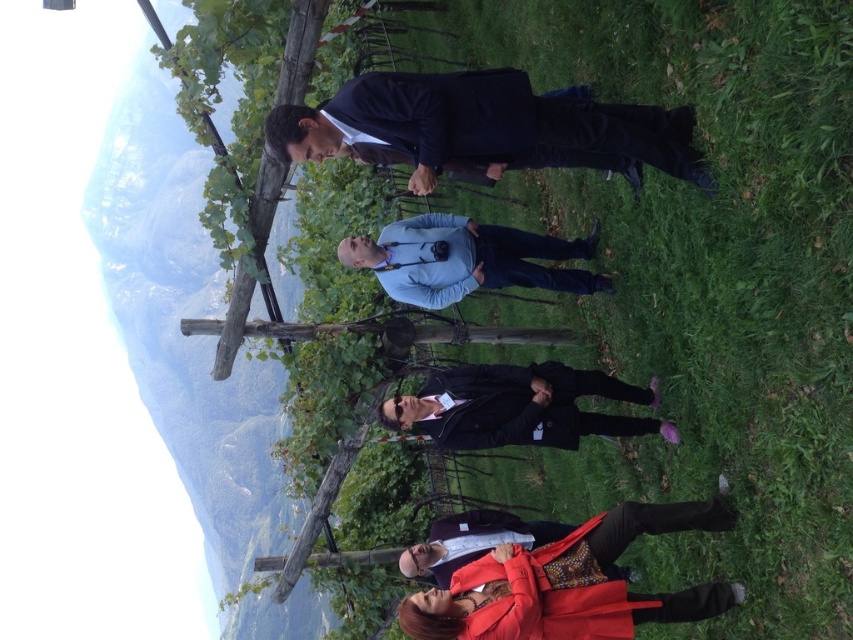
Who is shorter, dark blue suit at center or dark blue woolen coat at center?

dark blue suit at center

Does dark blue suit at center have a greater height compared to dark blue woolen coat at center?

No.

Does point (625, 124) lie behind point (566, 435)?

No, (625, 124) is in front of (566, 435).

At what (x,y) coordinates should I click in order to perform the action: click on dark blue suit at center. Please return your answer as a coordinate pair (x, y). Image resolution: width=853 pixels, height=640 pixels. Looking at the image, I should click on (486, 128).

Can you confirm if dark blue woolen coat at center is positioned above matte red coat at lower center?

Correct, dark blue woolen coat at center is located above matte red coat at lower center.

Between point (596, 433) and point (463, 612), which one is positioned in front?

Point (463, 612) is more forward.

Where is `dark blue woolen coat at center`? dark blue woolen coat at center is located at coordinates (527, 406).

Image resolution: width=853 pixels, height=640 pixels. What are the coordinates of `dark blue woolen coat at center` in the screenshot? It's located at click(x=527, y=406).

Is green grass at center smaller than dark blue suit at center?

No, green grass at center is not smaller than dark blue suit at center.

Is point (567, 497) in front of point (589, 164)?

No.

Locate an element on the screen. The width and height of the screenshot is (853, 640). green grass at center is located at coordinates click(711, 282).